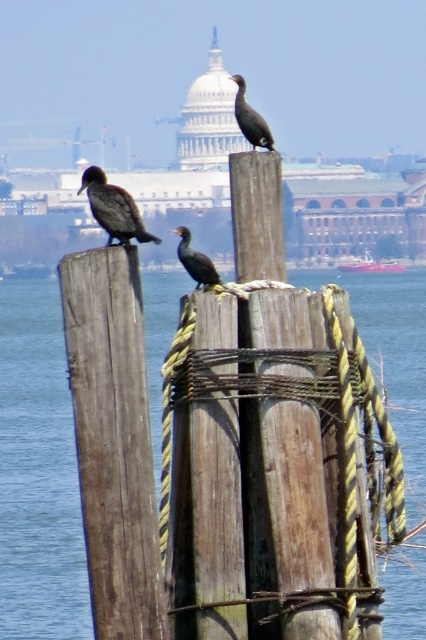
You are a boat operator who needs to dock the orange plastic boat at center near the weathered wood post at center. Given that the boat is 10 feet long, can you safely maneuver the boat to the post without hitting it?

The weathered wood post at center and orange plastic boat at center are 975.61 feet apart from each other. Since the boat is only 10 feet long, there is ample space between them, so yes, you can safely maneuver the boat to the post without hitting it.

You are a photographer planning to take a photo of the weathered wood post at center and the orange plastic boat at center. To ensure both are in focus, you need to know their vertical positions. Which object is located higher in the image?

The orange plastic boat at center is higher than the weathered wood post at center because the weathered wood post at center is below the orange plastic boat at center.

You are standing at the point closest to the viewer in the image. Which of the two points, point (261, 138) or point (373, 262), is closer to you?

Point (261, 138) is closer to the viewer than point (373, 262).